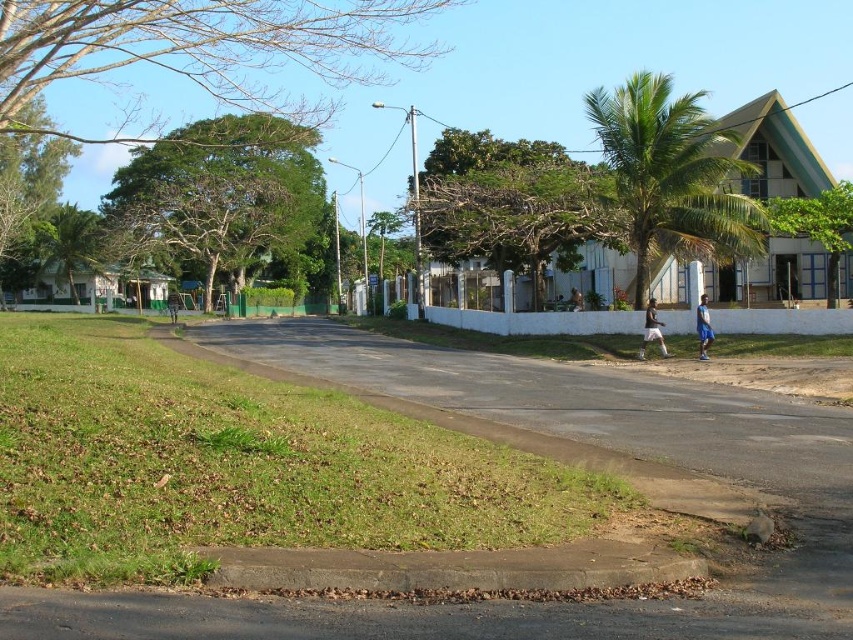
Does white fabric shorts at lower right appear on the right side of blue fabric shorts at lower right?

Incorrect, white fabric shorts at lower right is not on the right side of blue fabric shorts at lower right.

Is white fabric shorts at lower right thinner than blue fabric shorts at lower right?

In fact, white fabric shorts at lower right might be wider than blue fabric shorts at lower right.

Describe the element at coordinates (653, 330) in the screenshot. This screenshot has width=853, height=640. I see `white fabric shorts at lower right` at that location.

Image resolution: width=853 pixels, height=640 pixels. Identify the location of white fabric shorts at lower right. (653, 330).

Between point (704, 300) and point (579, 305), which one is positioned behind?

The point (579, 305) is behind.

Which is in front, point (705, 307) or point (575, 300)?

Point (705, 307) is in front.

Is point (705, 298) closer to viewer compared to point (576, 304)?

That is True.

What are the coordinates of `blue fabric shorts at lower right` in the screenshot? It's located at (703, 326).

The width and height of the screenshot is (853, 640). Find the location of `white fabric shorts at lower right`. white fabric shorts at lower right is located at coordinates (x=653, y=330).

Can you confirm if white fabric shorts at lower right is shorter than white fabric person at center?

No, white fabric shorts at lower right is not shorter than white fabric person at center.

Image resolution: width=853 pixels, height=640 pixels. What are the coordinates of `white fabric shorts at lower right` in the screenshot? It's located at pos(653,330).